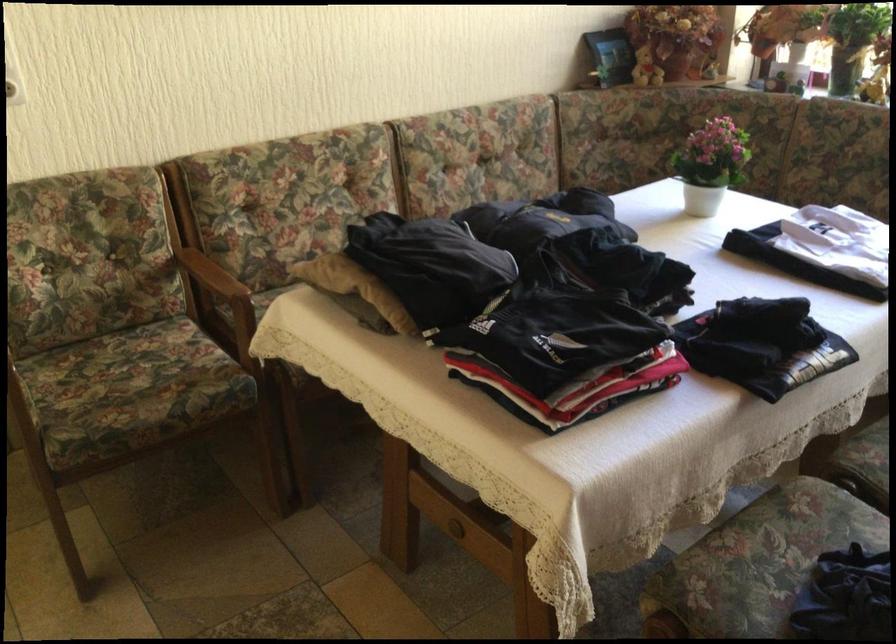
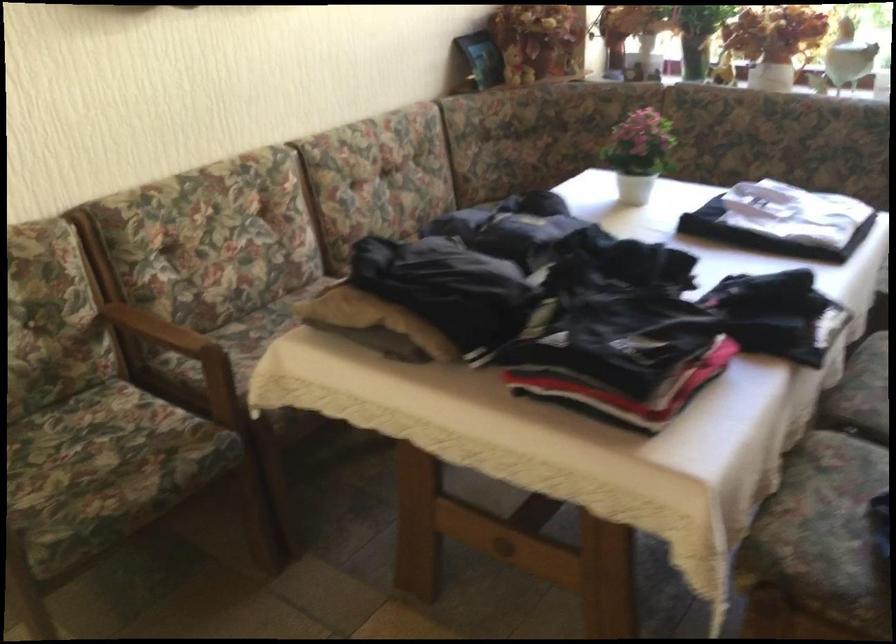
In the second image, find the point that corresponds to [117,362] in the first image.

(67, 444)